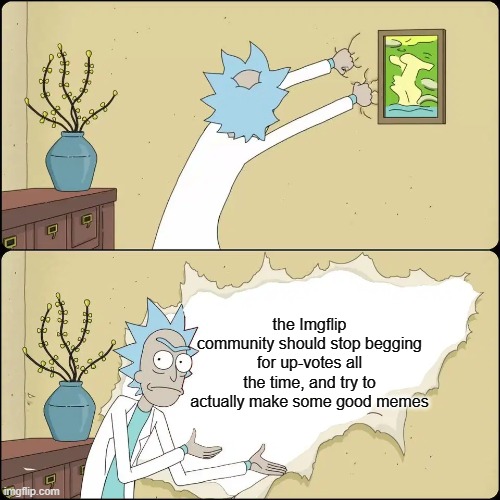
Where is `bottom screen hole torn in wall`? The height and width of the screenshot is (500, 500). bottom screen hole torn in wall is located at coordinates (395, 421), (362, 260), (198, 282), (258, 279), (238, 495), (302, 459), (419, 277), (152, 448), (167, 480).